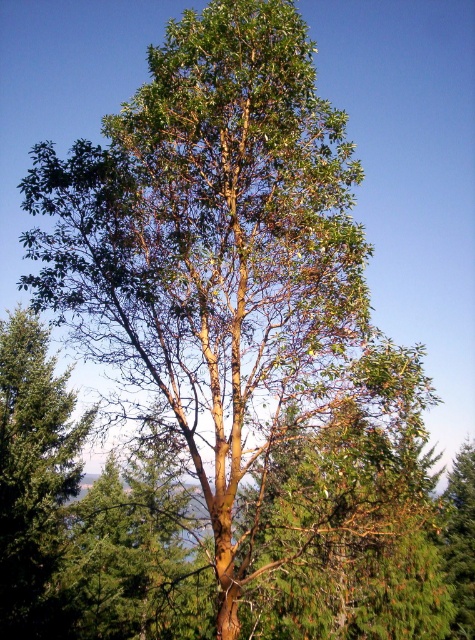
You are an arborist examining two trees in a forest. You see the green matte tree at left and the green matte tree at center. Which tree has a smaller trunk diameter?

The green matte tree at left has a smaller trunk diameter than the green matte tree at center.

You are standing in a forest and see a green matte tree at left. There is a point marked at coordinates point [35,480]. Is this point located on the green matte tree at left?

Yes, the point [35,480] is located on the green matte tree at left.

You are planning to plant a new tree that requires at least 50 feet of space between it and any other trees to thrive. Given the current spacing between the green matte tree at left and the green matte tree at center, can you plant the new tree between them without violating the spacing requirement?

The green matte tree at left and the green matte tree at center are 42.70 feet apart. Since the required spacing for the new tree is at least 50 feet, planting it between them would not meet the requirement as the existing distance is less than 50 feet.